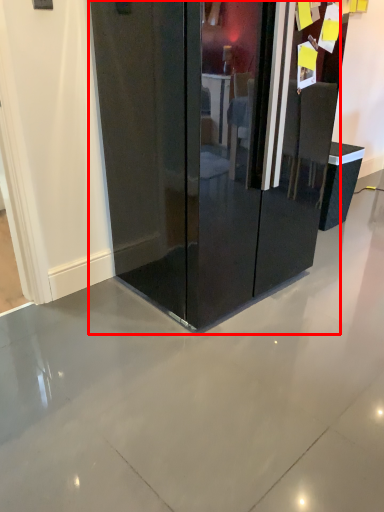
Question: From the image's perspective, where is glass door (annotated by the red box) located in relation to furniture in the image?

Choices:
 (A) above
 (B) below

Answer: (A)